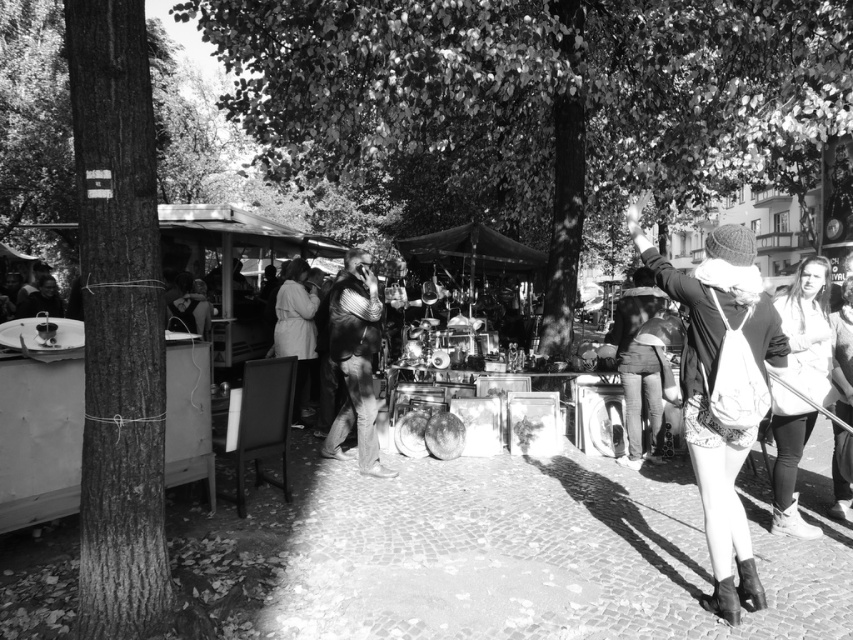
Which is more to the right, knitted wool hat at upper right or light beige fabric coat at center?

knitted wool hat at upper right

Between point (724, 483) and point (294, 333), which one is positioned behind?

Positioned behind is point (294, 333).

Locate an element on the screen. The image size is (853, 640). knitted wool hat at upper right is located at coordinates (715, 387).

Between white textured sweater at right and leather jacket at center, which one is positioned higher?

leather jacket at center

Looking at this image, is the position of white textured sweater at right less distant than that of leather jacket at center?

Yes, white textured sweater at right is in front of leather jacket at center.

Identify the location of white textured sweater at right. (799, 388).

Which is more to the right, leather jacket at center or light beige fabric coat at center?

leather jacket at center is more to the right.

Does leather jacket at center have a lesser height compared to light beige fabric coat at center?

Incorrect, leather jacket at center's height does not fall short of light beige fabric coat at center's.

Who is more distant from viewer, (360, 410) or (296, 262)?

Positioned behind is point (296, 262).

At what (x,y) coordinates should I click in order to perform the action: click on leather jacket at center. Please return your answer as a coordinate pair (x, y). This screenshot has width=853, height=640. Looking at the image, I should click on (355, 360).